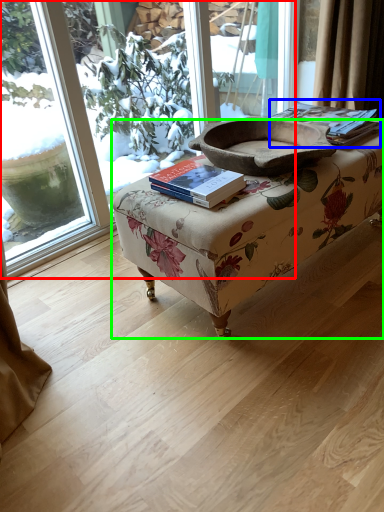
Question: Estimate the real-world distances between objects in this image. Which object is farther from window (highlighted by a red box), paperback book (highlighted by a blue box) or table (highlighted by a green box)?

Choices:
 (A) paperback book
 (B) table

Answer: (B)